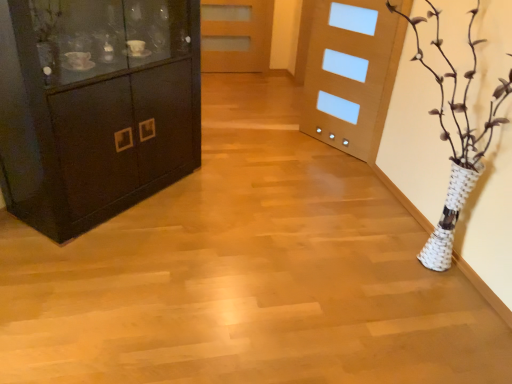
Question: From the image's perspective, is matte wood door at center positioned above or below matte black cabinet at left?

Choices:
 (A) below
 (B) above

Answer: (B)

Question: In terms of size, does matte wood door at center appear bigger or smaller than matte black cabinet at left?

Choices:
 (A) big
 (B) small

Answer: (B)

Question: Considering the positions of matte wood door at center and matte black cabinet at left in the image, is matte wood door at center wider or thinner than matte black cabinet at left?

Choices:
 (A) thin
 (B) wide

Answer: (A)

Question: Is point pos(119,84) closer or farther from the camera than point pos(262,16)?

Choices:
 (A) farther
 (B) closer

Answer: (B)

Question: Looking at the image, does matte black cabinet at left seem bigger or smaller compared to matte wood door at center?

Choices:
 (A) big
 (B) small

Answer: (A)

Question: In the image, is matte black cabinet at left on the left side or the right side of matte wood door at center?

Choices:
 (A) left
 (B) right

Answer: (A)

Question: From a real-world perspective, is matte black cabinet at left above or below matte wood door at center?

Choices:
 (A) below
 (B) above

Answer: (B)